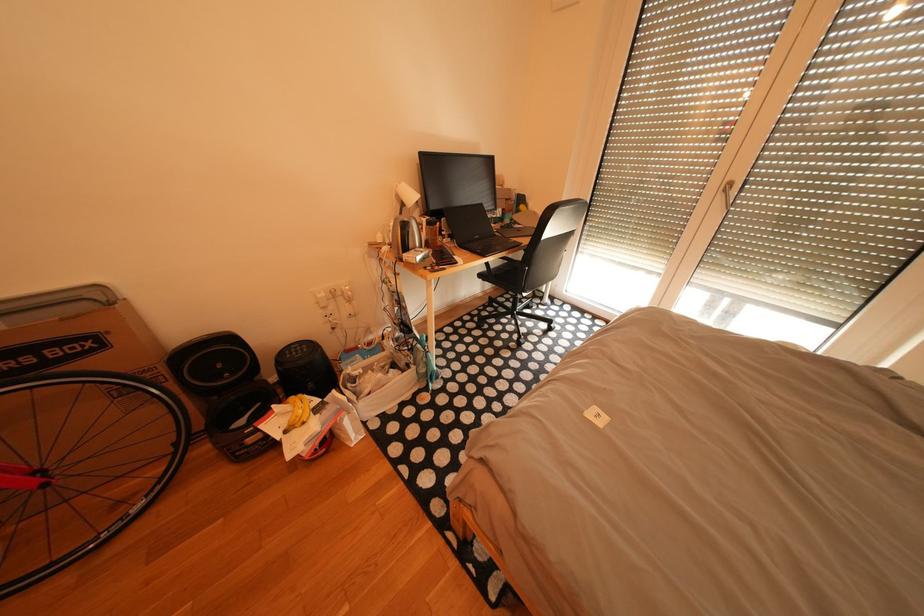
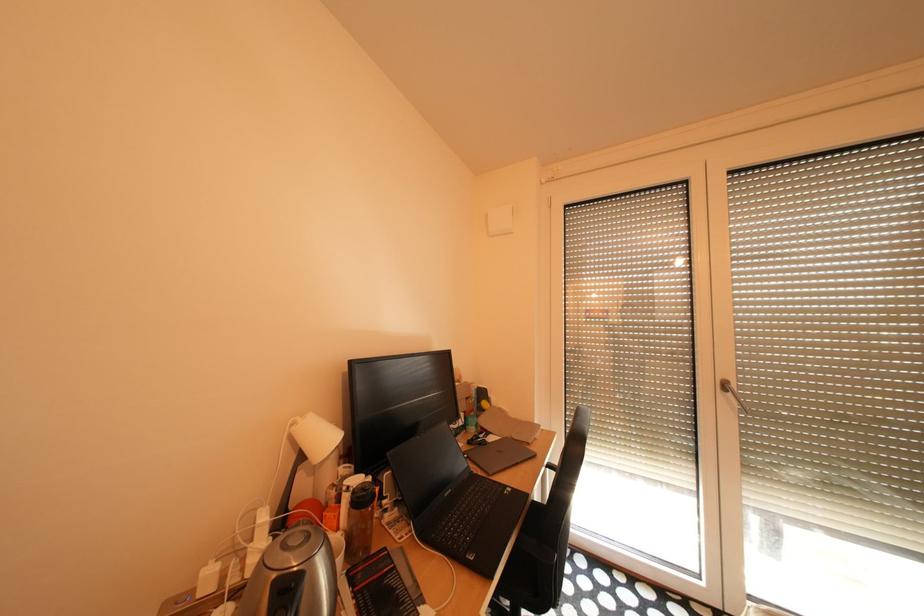
The images are taken continuously from a first-person perspective. In which direction is your viewpoint rotating?

The rotation direction of the camera is right-up.